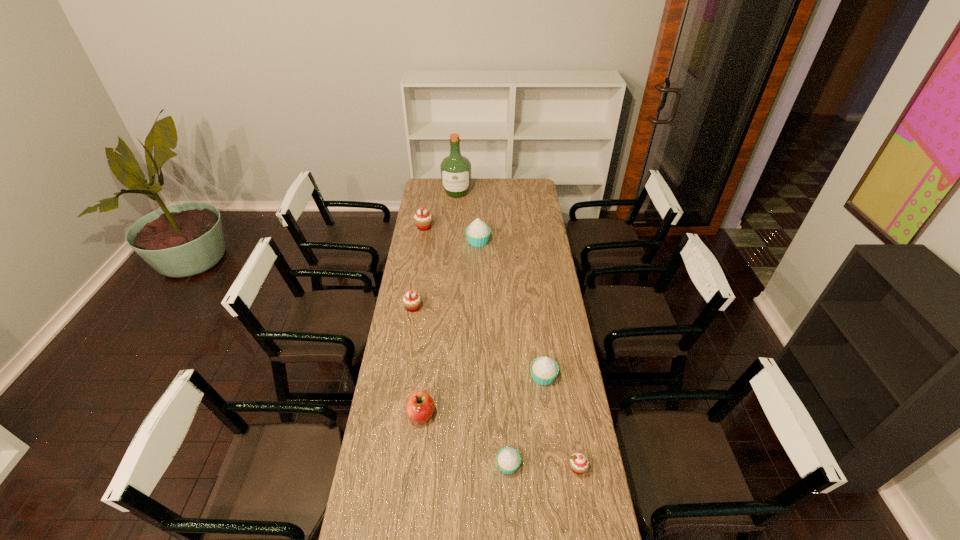
Where is `cupcake that stands as the fourth closest to the sixth farthest object`? cupcake that stands as the fourth closest to the sixth farthest object is located at coordinates (579, 463).

Find the location of `white cupcake object that ranks as the closest to the second farthest object`. white cupcake object that ranks as the closest to the second farthest object is located at coordinates click(x=477, y=233).

You are a GUI agent. You are given a task and a screenshot of the screen. Output one action in this format:
    pyautogui.click(x=<x>, y=<y>)
    Task: Click on the white cupcake that is the second nearest to the farthest cupcake
    Image resolution: width=960 pixels, height=540 pixels.
    Given the screenshot: What is the action you would take?
    pyautogui.click(x=544, y=370)

In order to click on pink cupcake that is the closest to the nearest pink cupcake in this screenshot , I will do click(x=411, y=300).

This screenshot has height=540, width=960. I want to click on pink cupcake that is the closest to the second biggest pink cupcake, so click(423, 219).

Locate an element on the screen. This screenshot has width=960, height=540. free location that satisfies the following two spatial constraints: 1. on the front side of the rightmost pink cupcake; 2. on the left side of the sixth nearest object is located at coordinates (477, 468).

In order to click on vacant space that satisfies the following two spatial constraints: 1. on the front side of the rightmost white cupcake; 2. on the right side of the farthest pink cupcake in this screenshot , I will do `click(400, 376)`.

Find the location of a particular element. The height and width of the screenshot is (540, 960). vacant space that satisfies the following two spatial constraints: 1. on the front-facing side of the tallest object; 2. on the left side of the smallest white cupcake is located at coordinates (437, 465).